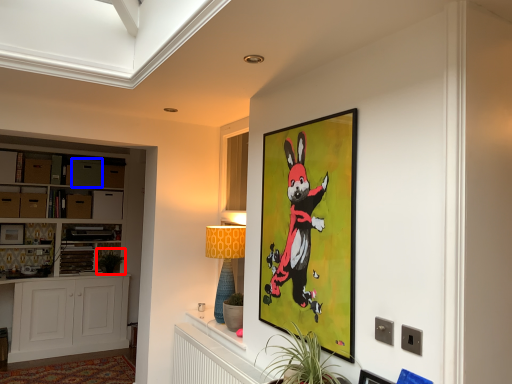
Question: Which point is closer to the camera, plant (highlighted by a red box) or drawer (highlighted by a blue box)?

Choices:
 (A) plant
 (B) drawer

Answer: (B)